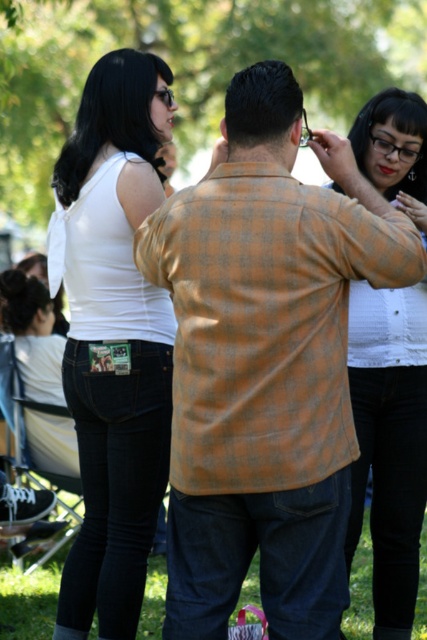
You are a photographer trying to capture a group photo of the orange checkered shirt at center and the white matte tank top at upper left. To ensure both are in frame, which direction should you move the camera slightly?

You should move the camera to the left slightly because the orange checkered shirt at center is positioned on the right side of white matte tank top at upper left, so shifting left will keep both in frame.